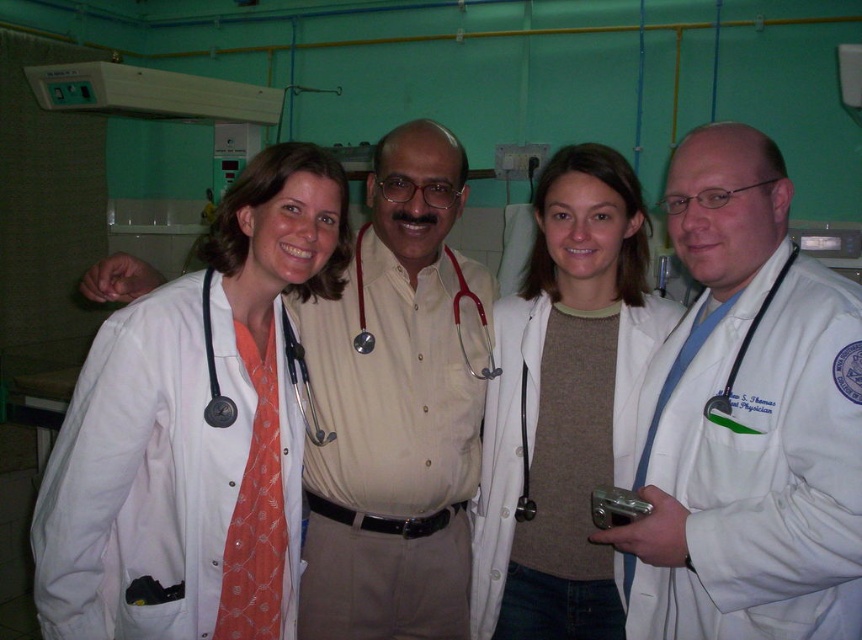
Question: Is white matte lab coat at center in front of matte red stethoscope at center?

Choices:
 (A) no
 (B) yes

Answer: (B)

Question: Which is farther from the black rubber stethoscope at right?

Choices:
 (A) matte black stethoscope at center
 (B) matte white coat at center

Answer: (A)

Question: Which point is farther from the camera taking this photo?

Choices:
 (A) (325, 436)
 (B) (322, 320)

Answer: (B)

Question: Which of the following is the closest to the observer?

Choices:
 (A) matte red stethoscope at center
 (B) white matte lab coat at left
 (C) matte white coat at center
 (D) beige stethoscope at center

Answer: (B)

Question: Observing the image, what is the correct spatial positioning of matte white coat at center in reference to matte red stethoscope at center?

Choices:
 (A) below
 (B) above

Answer: (A)

Question: Is white matte lab coat at center positioned in front of matte red stethoscope at center?

Choices:
 (A) no
 (B) yes

Answer: (B)